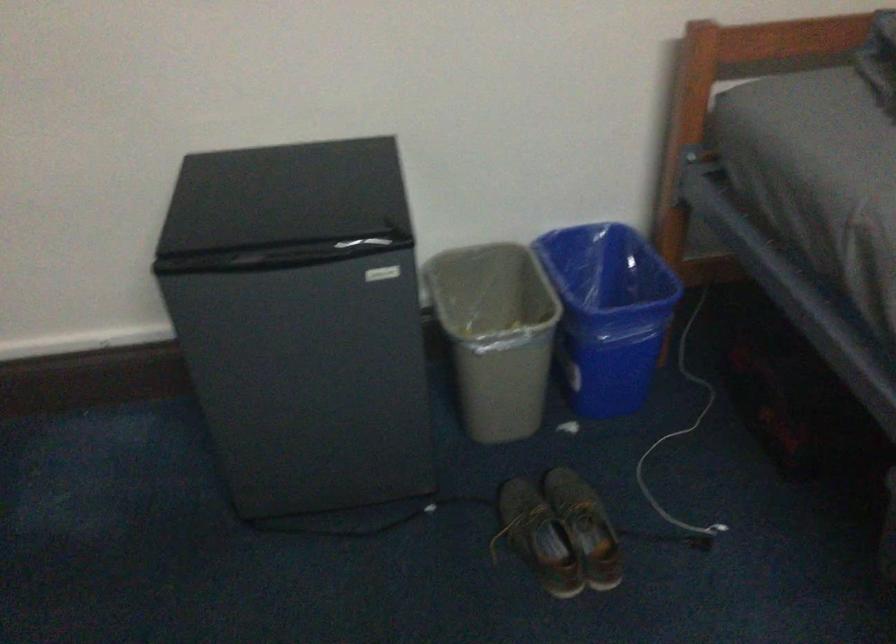
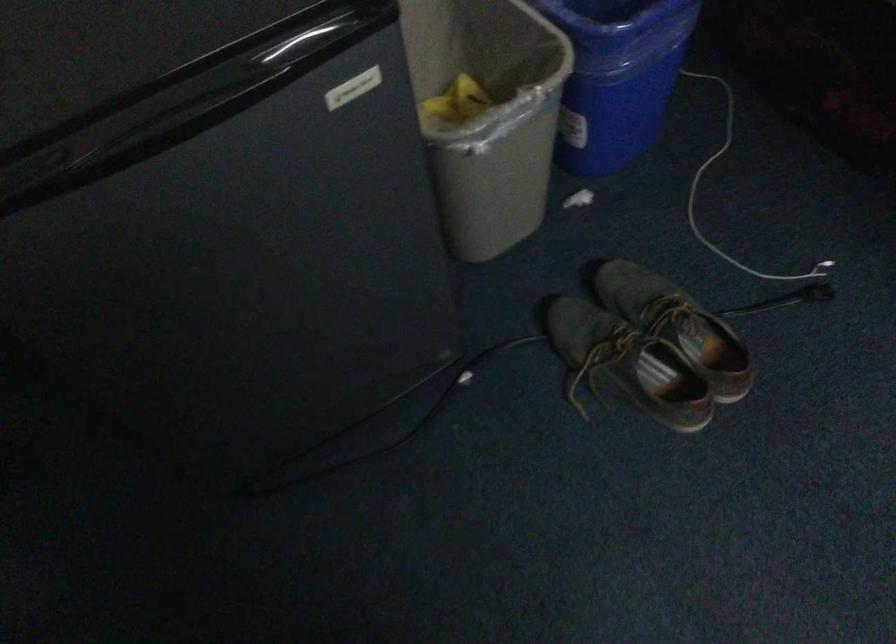
Question: The first image is from the beginning of the video and the second image is from the end. How did the camera likely rotate when shooting the video?

Choices:
 (A) Left
 (B) Right
 (C) Up
 (D) Down

Answer: (D)